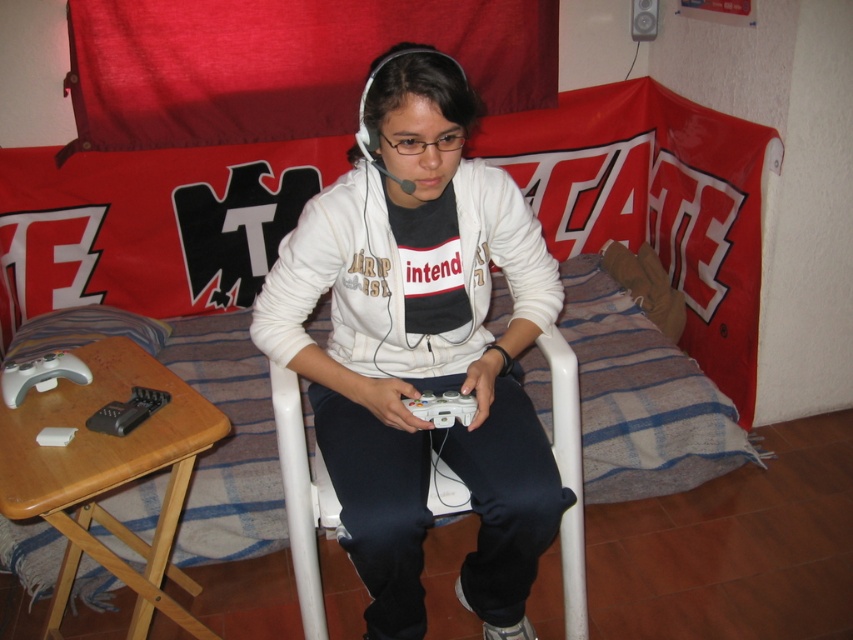
Where is `white matte jacket at center`? white matte jacket at center is located at coordinates (422, 348).

In the scene shown: Is white matte jacket at center above white matte game controller at lower center?

Yes.

Is point (413, 627) positioned behind point (437, 403)?

Yes, point (413, 627) is behind point (437, 403).

The height and width of the screenshot is (640, 853). What are the coordinates of `white matte jacket at center` in the screenshot? It's located at (422, 348).

Is white matte jacket at center closer to camera compared to white matte game controller at left?

Yes, white matte jacket at center is closer to the viewer.

Which is above, white matte jacket at center or white matte game controller at left?

white matte game controller at left is higher up.

Is point (273, 342) farther from viewer compared to point (28, 360)?

No, it is not.

Find the location of a particular element. Image resolution: width=853 pixels, height=640 pixels. white matte jacket at center is located at coordinates (422, 348).

Is white matte game controller at left below white matte game controller at lower center?

No, white matte game controller at left is not below white matte game controller at lower center.

This screenshot has width=853, height=640. Describe the element at coordinates (41, 376) in the screenshot. I see `white matte game controller at left` at that location.

You are a GUI agent. You are given a task and a screenshot of the screen. Output one action in this format:
    pyautogui.click(x=<x>, y=<y>)
    Task: Click on the white matte game controller at left
    Image resolution: width=853 pixels, height=640 pixels.
    Given the screenshot: What is the action you would take?
    pyautogui.click(x=41, y=376)